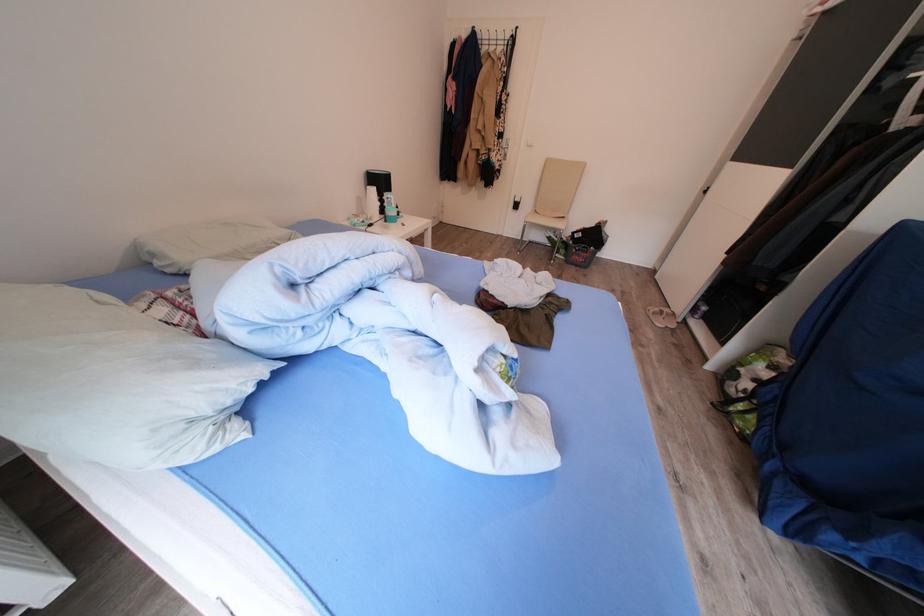
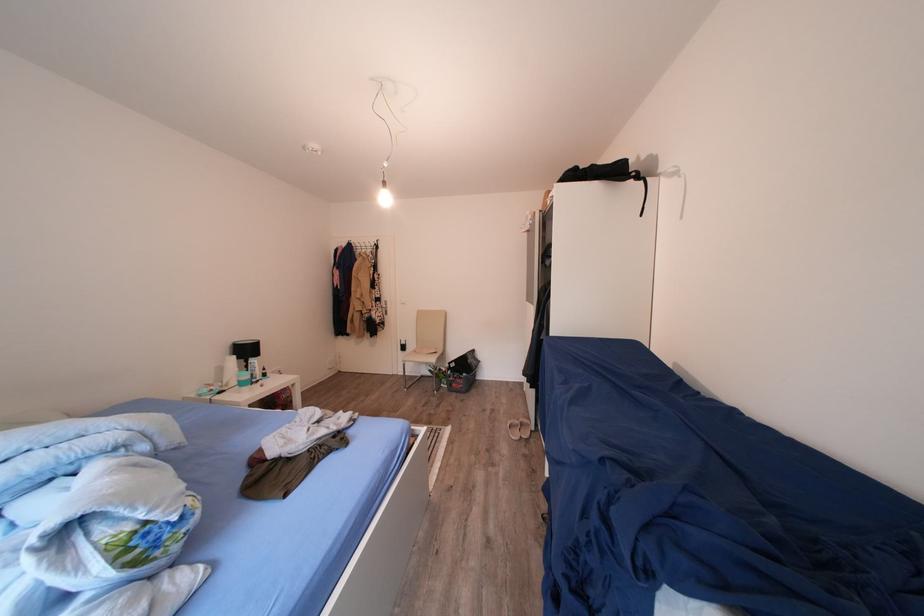
Find the pixel in the second image that matches point (388, 188) in the first image.

(256, 355)